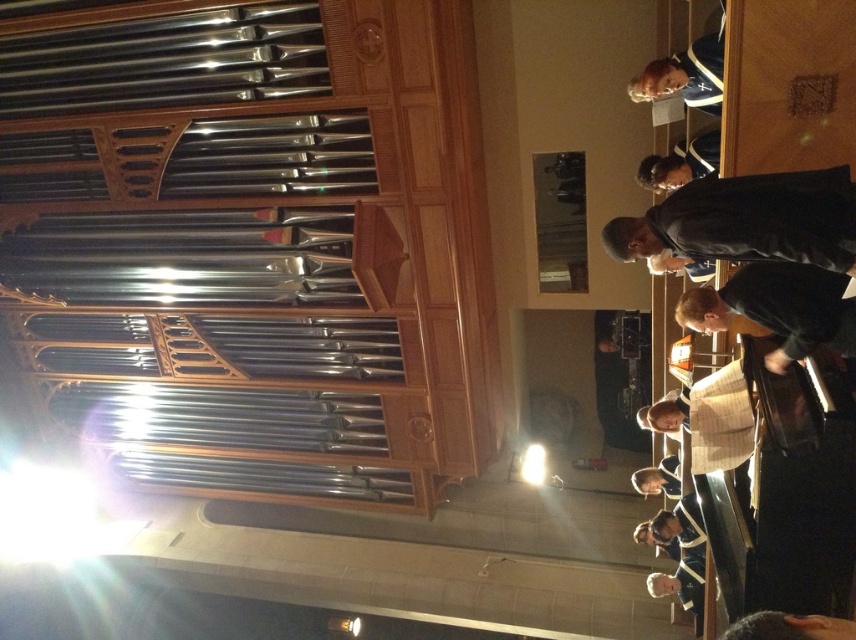
Is black matte jacket at upper right to the left of blue fabric at upper center from the viewer's perspective?

Correct, you'll find black matte jacket at upper right to the left of blue fabric at upper center.

Is black matte jacket at upper right thinner than blue fabric at upper center?

No.

Who is more forward, (704, 204) or (716, 42)?

Point (704, 204) is in front.

Locate an element on the screen. black matte jacket at upper right is located at coordinates (747, 220).

Between black matte conductor at lower right and black leather jacket at upper right, which one appears on the right side from the viewer's perspective?

black matte conductor at lower right

Can you confirm if black matte conductor at lower right is thinner than black leather jacket at upper right?

Indeed, black matte conductor at lower right has a lesser width compared to black leather jacket at upper right.

The image size is (856, 640). Identify the location of black matte conductor at lower right. (777, 308).

Between black matte jacket at upper right and black matte conductor at lower right, which one appears on the left side from the viewer's perspective?

From the viewer's perspective, black matte jacket at upper right appears more on the left side.

From the picture: How much distance is there between black matte jacket at upper right and black matte conductor at lower right?

18.82 inches

Describe the element at coordinates (747, 220) in the screenshot. This screenshot has width=856, height=640. I see `black matte jacket at upper right` at that location.

Find the location of a particular element. Image resolution: width=856 pixels, height=640 pixels. black matte jacket at upper right is located at coordinates (747, 220).